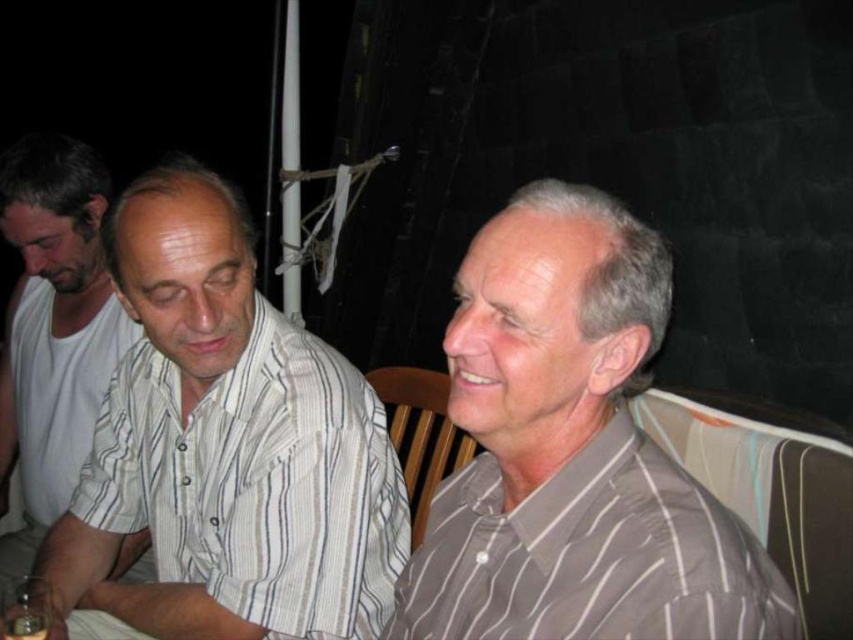
Between white striped shirt at center and white striped shirt at left, which one has less height?

With less height is white striped shirt at center.

Image resolution: width=853 pixels, height=640 pixels. I want to click on white striped shirt at center, so click(225, 448).

The width and height of the screenshot is (853, 640). What do you see at coordinates (225, 448) in the screenshot?
I see `white striped shirt at center` at bounding box center [225, 448].

The image size is (853, 640). In order to click on white striped shirt at center in this screenshot , I will do `click(225, 448)`.

Can you confirm if white striped shirt at center is positioned to the right of gray striped shirt at right?

Incorrect, white striped shirt at center is not on the right side of gray striped shirt at right.

Between white striped shirt at center and gray striped shirt at right, which one appears on the left side from the viewer's perspective?

From the viewer's perspective, white striped shirt at center appears more on the left side.

The width and height of the screenshot is (853, 640). Find the location of `white striped shirt at center`. white striped shirt at center is located at coordinates (225, 448).

Can you confirm if gray striped shirt at right is positioned below white striped shirt at left?

Yes.

I want to click on gray striped shirt at right, so click(x=573, y=452).

Which is in front, point (552, 275) or point (115, 352)?

Positioned in front is point (552, 275).

Where is `gray striped shirt at right`? gray striped shirt at right is located at coordinates (573, 452).